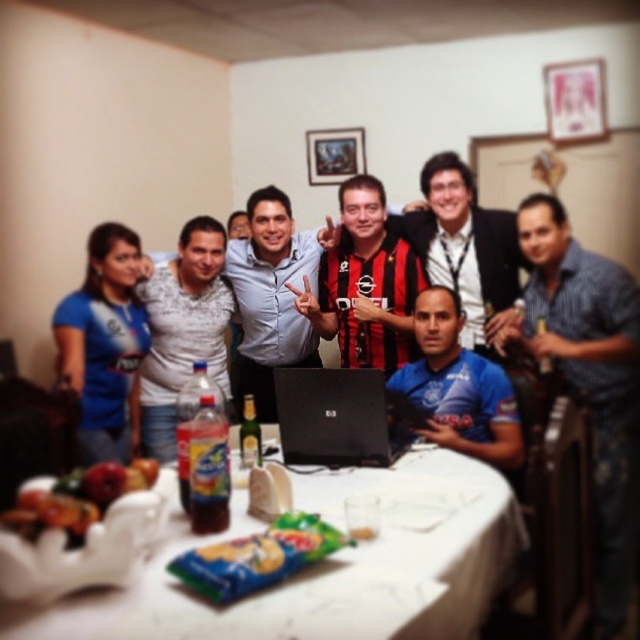
You are a photographer adjusting your camera settings to capture the scene. You want to focus on the shiny plastic bowl at lower left and the wooden picture frame at upper center. Which object should you adjust your focus to first to ensure it appears sharp in the final photo?

The shiny plastic bowl at lower left is closer to the viewer than the wooden picture frame at upper center, so you should focus on the shiny plastic bowl at lower left first. This ensures that the closer object is in focus, and the frame will also be sharp due to depth of field.